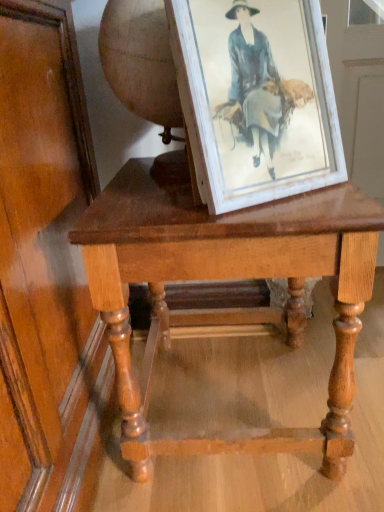
The height and width of the screenshot is (512, 384). I want to click on free space to the left of white distressed wood picture frame at center, so click(x=144, y=207).